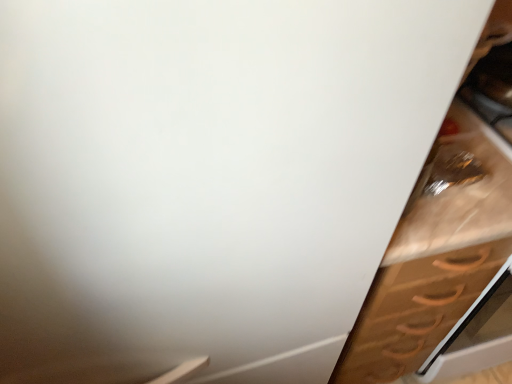
The image size is (512, 384). What do you see at coordinates (432, 263) in the screenshot?
I see `wooden cabinet at right` at bounding box center [432, 263].

Find the location of `wooden cabinet at right`. wooden cabinet at right is located at coordinates (432, 263).

You are a GUI agent. You are given a task and a screenshot of the screen. Output one action in this format:
    pyautogui.click(x=<x>, y=<y>)
    Task: Click on the wooden cabinet at right
    
    Given the screenshot: What is the action you would take?
    pyautogui.click(x=432, y=263)